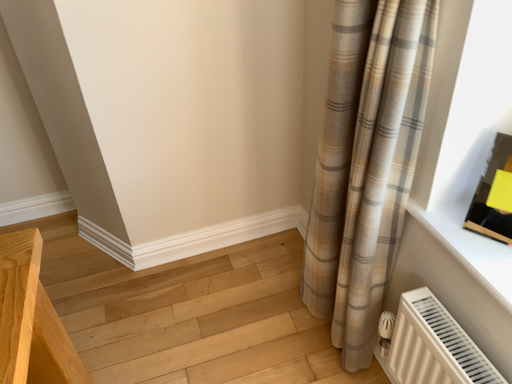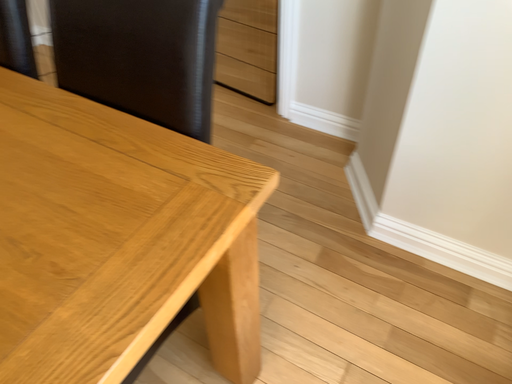
Question: How did the camera likely rotate when shooting the video?

Choices:
 (A) rotated right
 (B) rotated left

Answer: (B)